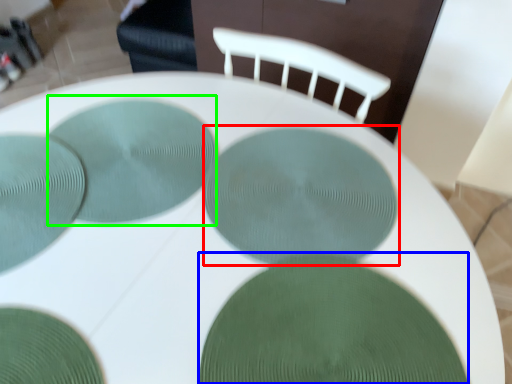
Question: Which object is the closest to the glass plate (highlighted by a red box)? Choose among these: glass plate (highlighted by a blue box) or glass plate (highlighted by a green box).

Choices:
 (A) glass plate
 (B) glass plate

Answer: (A)